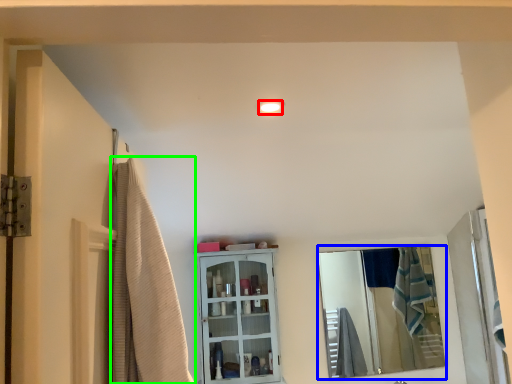
Question: Considering the real-world distances, which object is closest to light fixture (highlighted by a red box)? mirror (highlighted by a blue box) or shower curtain (highlighted by a green box).

Choices:
 (A) mirror
 (B) shower curtain

Answer: (B)